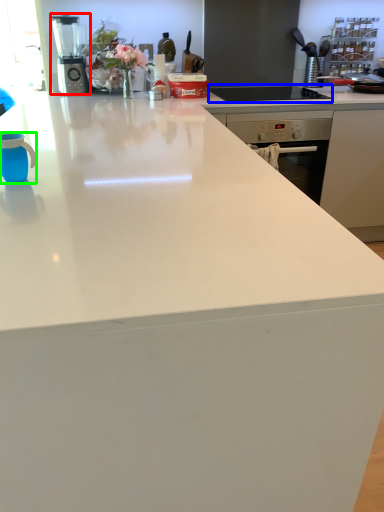
Question: Which is farther away from kitchen appliance (highlighted by a red box)? gas stove (highlighted by a blue box) or mug (highlighted by a green box)?

Choices:
 (A) gas stove
 (B) mug

Answer: (B)